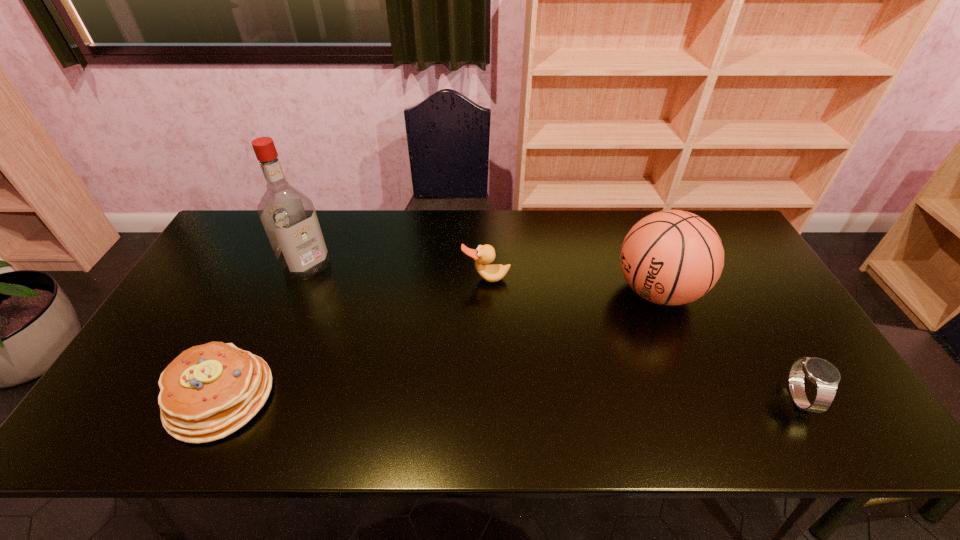
Find the location of a particular element. free space between the duck and the pancake is located at coordinates (353, 338).

You are a GUI agent. You are given a task and a screenshot of the screen. Output one action in this format:
    pyautogui.click(x=<x>, y=<y>)
    Task: Click on the vacant space in between the pancake and the rightmost object
    Image resolution: width=960 pixels, height=540 pixels.
    Given the screenshot: What is the action you would take?
    pyautogui.click(x=510, y=397)

This screenshot has height=540, width=960. I want to click on free spot between the watch and the basketball, so click(x=728, y=345).

The height and width of the screenshot is (540, 960). What are the coordinates of `vacant point located between the tallest object and the fourth object from left to right` in the screenshot? It's located at (482, 279).

You are a GUI agent. You are given a task and a screenshot of the screen. Output one action in this format:
    pyautogui.click(x=<x>, y=<y>)
    Task: Click on the unoccupied area between the watch and the pancake
    The height and width of the screenshot is (540, 960).
    Given the screenshot: What is the action you would take?
    510,397

You are a GUI agent. You are given a task and a screenshot of the screen. Output one action in this format:
    pyautogui.click(x=<x>, y=<y>)
    Task: Click on the free point between the pancake and the basketball
    
    Given the screenshot: What is the action you would take?
    pyautogui.click(x=439, y=344)

Find the location of `free space between the liquor and the pancake`. free space between the liquor and the pancake is located at coordinates (264, 332).

The width and height of the screenshot is (960, 540). What are the coordinates of `the fourth closest object to the fourth object from left to right` in the screenshot? It's located at (209, 391).

Locate an element on the screen. The image size is (960, 540). object that stands as the second closest to the liquor is located at coordinates (484, 254).

Where is `free region that satisfies the following two spatial constraints: 1. on the front side of the third object from left to right; 2. on the right side of the second tallest object`? free region that satisfies the following two spatial constraints: 1. on the front side of the third object from left to right; 2. on the right side of the second tallest object is located at coordinates (486, 291).